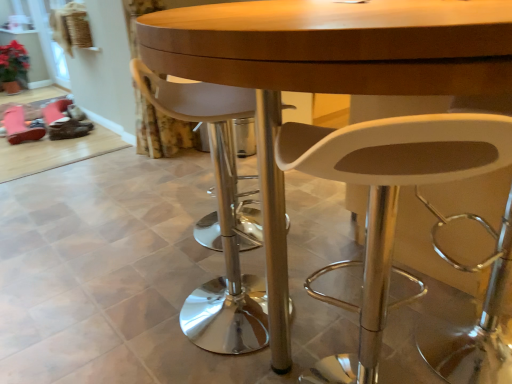
The height and width of the screenshot is (384, 512). I want to click on white plastic stool at center, placed as the 1th chair when sorted from left to right, so click(217, 218).

What are the coordinates of `pink suede shoe at lower left` in the screenshot? It's located at (19, 126).

The height and width of the screenshot is (384, 512). Find the location of `matte wood table at center`. matte wood table at center is located at coordinates (328, 72).

Is point (55, 129) closer to camera compared to point (220, 201)?

No, (55, 129) is further to viewer.

How far apart are brown leather shoe at lower left and white plastic stool at center, placed as the 1th chair when sorted from left to right?

2.25 meters.

Can you confirm if brown leather shoe at lower left is positioned to the left of white plastic stool at center, the second chair from the right?

Correct, you'll find brown leather shoe at lower left to the left of white plastic stool at center, the second chair from the right.

In order to click on shoe that is under the white plastic stool at center, the second chair from the right (from a real-world perspective) in this screenshot , I will do `click(68, 129)`.

Considering the relative positions of white plastic chair at center, which appears as the second chair when viewed from the left, and transparent glass door at upper left in the image provided, is white plastic chair at center, which appears as the second chair when viewed from the left, behind transparent glass door at upper left?

No, white plastic chair at center, which appears as the second chair when viewed from the left, is closer to the viewer.

Can we say white plastic chair at center, which appears as the second chair when viewed from the left, lies outside transparent glass door at upper left?

That's correct, white plastic chair at center, which appears as the second chair when viewed from the left, is outside of transparent glass door at upper left.

Is white plastic chair at center, which appears as the second chair when viewed from the left, smaller than transparent glass door at upper left?

No.

How different are the orientations of white plastic chair at center, placed as the 1th chair when sorted from right to left, and transparent glass door at upper left in degrees?

132 degrees separate the facing orientations of white plastic chair at center, placed as the 1th chair when sorted from right to left, and transparent glass door at upper left.

Is pink suede shoe at lower left positioned with its back to white plastic chair at center, which appears as the second chair when viewed from the left?

No.

Considering the sizes of objects pink suede shoe at lower left and white plastic chair at center, placed as the 1th chair when sorted from right to left, in the image provided, who is shorter, pink suede shoe at lower left or white plastic chair at center, placed as the 1th chair when sorted from right to left,?

With less height is pink suede shoe at lower left.

Would you say pink suede shoe at lower left is to the left or to the right of white plastic chair at center, which appears as the second chair when viewed from the left, in the picture?

pink suede shoe at lower left is positioned on white plastic chair at center, which appears as the second chair when viewed from the left,'s left side.

Which of these two, pink suede shoe at lower left or white plastic chair at center, placed as the 1th chair when sorted from right to left, is thinner?

Thinner between the two is white plastic chair at center, placed as the 1th chair when sorted from right to left.

Is floral fabric curtain at lower left looking in the opposite direction of transparent glass door at upper left?

Correct, floral fabric curtain at lower left is looking away from transparent glass door at upper left.

Considering the relative sizes of floral fabric curtain at lower left and transparent glass door at upper left in the image provided, is floral fabric curtain at lower left shorter than transparent glass door at upper left?

In fact, floral fabric curtain at lower left may be taller than transparent glass door at upper left.

Is floral fabric curtain at lower left located outside transparent glass door at upper left?

Indeed, floral fabric curtain at lower left is completely outside transparent glass door at upper left.

Considering the positions of points (281, 144) and (178, 126), is point (281, 144) farther from camera compared to point (178, 126)?

That is False.

Is white plastic chair at center, placed as the 1th chair when sorted from right to left, facing towards floral fabric curtain at lower left?

No, white plastic chair at center, placed as the 1th chair when sorted from right to left, is not oriented towards floral fabric curtain at lower left.

Considering the sizes of objects white plastic chair at center, which appears as the second chair when viewed from the left, and floral fabric curtain at lower left in the image provided, who is smaller, white plastic chair at center, which appears as the second chair when viewed from the left, or floral fabric curtain at lower left?

floral fabric curtain at lower left.

What's the angular difference between white plastic chair at center, which appears as the second chair when viewed from the left, and floral fabric curtain at lower left's facing directions?

There is a 137-degree angle between the facing directions of white plastic chair at center, which appears as the second chair when viewed from the left, and floral fabric curtain at lower left.

Is transparent glass door at upper left wider than pink suede shoe at lower left?

No.

Does transparent glass door at upper left have a lesser height compared to pink suede shoe at lower left?

No.

Considering the positions of objects transparent glass door at upper left and pink suede shoe at lower left in the image provided, who is behind, transparent glass door at upper left or pink suede shoe at lower left?

transparent glass door at upper left is behind.

Is transparent glass door at upper left smaller than pink suede shoe at lower left?

Actually, transparent glass door at upper left might be larger than pink suede shoe at lower left.

Where is `glass door on the left of matte wood table at center`? The image size is (512, 384). glass door on the left of matte wood table at center is located at coordinates (49, 43).

Is the depth of transparent glass door at upper left less than that of matte wood table at center?

No.

From a real-world perspective, is transparent glass door at upper left positioned under matte wood table at center based on gravity?

No.

Which object is wider, transparent glass door at upper left or matte wood table at center?

matte wood table at center is wider.

Find the location of a particular element. Image resolution: width=512 pixels, height=384 pixels. chair that is the 1st object located below the brown leather shoe at lower left (from the image's perspective) is located at coordinates (217, 218).

Which chair is the 2nd one when counting from the front of the transparent glass door at upper left? Please provide its 2D coordinates.

[(387, 201)]

Considering their positions, is pink suede shoe at lower left positioned closer to brown leather shoe at lower left than matte wood table at center?

The object closer to brown leather shoe at lower left is pink suede shoe at lower left.

Which object lies further to the anchor point white plastic stool at center, the second chair from the right, matte wood table at center or transparent glass door at upper left?

The object further to white plastic stool at center, the second chair from the right, is transparent glass door at upper left.

From the image, which object appears to be farther from pink suede shoe at lower left, matte wood table at center or white plastic chair at center, placed as the 1th chair when sorted from right to left?

white plastic chair at center, placed as the 1th chair when sorted from right to left, is positioned further to the anchor pink suede shoe at lower left.

Based on the photo, which object lies nearer to the anchor point white plastic stool at center, placed as the 1th chair when sorted from left to right, brown leather shoe at lower left or white plastic chair at center, which appears as the second chair when viewed from the left?

Based on the image, white plastic chair at center, which appears as the second chair when viewed from the left, appears to be nearer to white plastic stool at center, placed as the 1th chair when sorted from left to right.

Estimate the real-world distances between objects in this image. Which object is further from white plastic stool at center, the second chair from the right, matte wood table at center or floral fabric curtain at lower left?

floral fabric curtain at lower left is positioned further to the anchor white plastic stool at center, the second chair from the right.

Based on their spatial positions, is floral fabric curtain at lower left or transparent glass door at upper left further from matte wood table at center?

transparent glass door at upper left is further to matte wood table at center.

Which object lies further to the anchor point pink suede shoe at lower left, matte wood table at center or white plastic stool at center, placed as the 1th chair when sorted from left to right?

The object further to pink suede shoe at lower left is matte wood table at center.

Based on their spatial positions, is floral fabric curtain at lower left or transparent glass door at upper left further from white plastic chair at center, which appears as the second chair when viewed from the left?

Among the two, transparent glass door at upper left is located further to white plastic chair at center, which appears as the second chair when viewed from the left.

Where is `footwear located between matte wood table at center and brown leather shoe at lower left in the depth direction`? The height and width of the screenshot is (384, 512). footwear located between matte wood table at center and brown leather shoe at lower left in the depth direction is located at coordinates (19, 126).

Find the location of a particular element. The height and width of the screenshot is (384, 512). curtain between white plastic chair at center, placed as the 1th chair when sorted from right to left, and pink suede shoe at lower left, along the z-axis is located at coordinates (159, 130).

Find the location of `curtain located between white plastic stool at center, placed as the 1th chair when sorted from left to right, and brown leather shoe at lower left in the depth direction`. curtain located between white plastic stool at center, placed as the 1th chair when sorted from left to right, and brown leather shoe at lower left in the depth direction is located at coordinates (159, 130).

Where is `chair between white plastic chair at center, placed as the 1th chair when sorted from right to left, and pink suede shoe at lower left in the front-back direction`? The width and height of the screenshot is (512, 384). chair between white plastic chair at center, placed as the 1th chair when sorted from right to left, and pink suede shoe at lower left in the front-back direction is located at coordinates (217, 218).